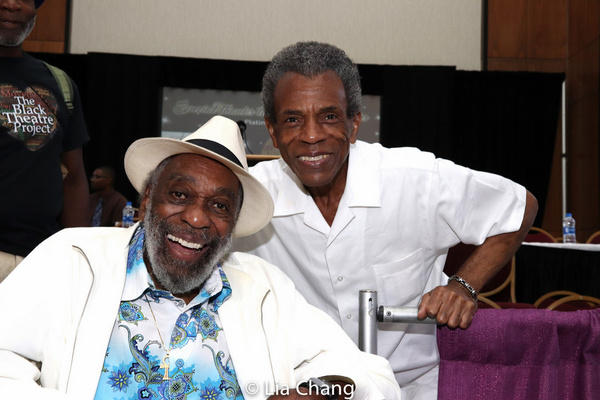
Locate an element on the screen. The width and height of the screenshot is (600, 400). purple curtain fabric is located at coordinates (528, 349).